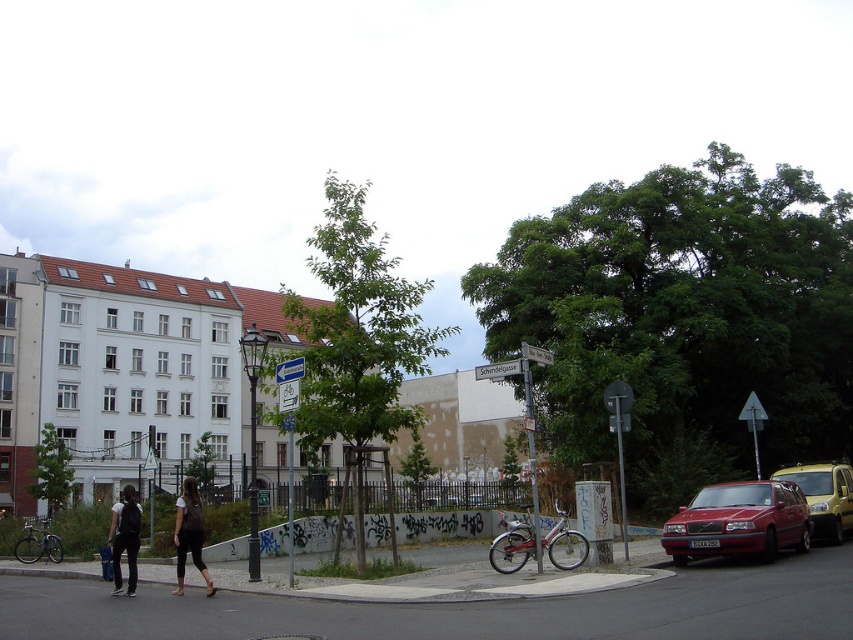
Can you confirm if yellow matte taxi at right is taller than dark brown leather jacket at lower left?

In fact, yellow matte taxi at right may be shorter than dark brown leather jacket at lower left.

Does point (844, 464) lie behind point (194, 484)?

Yes.

Locate an element on the screen. yellow matte taxi at right is located at coordinates (824, 497).

Who is shorter, dark brown leather backpack at lower left or dark gray fabric jacket at lower left?

Standing shorter between the two is dark brown leather backpack at lower left.

Who is positioned more to the right, dark brown leather backpack at lower left or dark gray fabric jacket at lower left?

Positioned to the right is dark brown leather backpack at lower left.

Image resolution: width=853 pixels, height=640 pixels. Find the location of `dark brown leather backpack at lower left`. dark brown leather backpack at lower left is located at coordinates (189, 534).

Locate an element on the screen. dark brown leather backpack at lower left is located at coordinates (189, 534).

Can you confirm if dark brown leather jacket at lower left is positioned to the right of dark gray fabric jacket at lower left?

Correct, you'll find dark brown leather jacket at lower left to the right of dark gray fabric jacket at lower left.

Is dark brown leather jacket at lower left taller than dark gray fabric jacket at lower left?

Incorrect, dark brown leather jacket at lower left's height is not larger of dark gray fabric jacket at lower left's.

Who is more forward, (189, 508) or (109, 536)?

Point (189, 508) is more forward.

Find the location of a particular element. dark brown leather jacket at lower left is located at coordinates (189, 534).